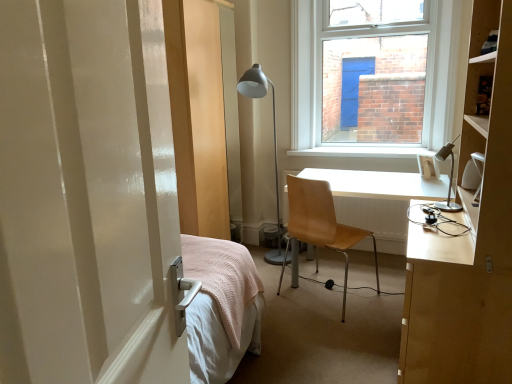
Question: Can you confirm if white plastic picture frame at upper right is positioned to the right of silver metallic desk lamp at right, placed as the second lamp when sorted from back to front?

Choices:
 (A) yes
 (B) no

Answer: (A)

Question: Can you confirm if white plastic picture frame at upper right is wider than silver metallic desk lamp at right, which is counted as the first lamp, starting from the right?

Choices:
 (A) yes
 (B) no

Answer: (B)

Question: Considering the relative positions of white plastic picture frame at upper right and silver metallic desk lamp at right, which is counted as the first lamp, starting from the right, in the image provided, is white plastic picture frame at upper right behind silver metallic desk lamp at right, which is counted as the first lamp, starting from the right,?

Choices:
 (A) yes
 (B) no

Answer: (A)

Question: From the image's perspective, is white plastic picture frame at upper right over silver metallic desk lamp at right, which is counted as the first lamp, starting from the right?

Choices:
 (A) yes
 (B) no

Answer: (A)

Question: Is white plastic picture frame at upper right shorter than silver metallic desk lamp at right, the second lamp in the left-to-right sequence?

Choices:
 (A) yes
 (B) no

Answer: (A)

Question: From a real-world perspective, is light brown wood chair at center above or below white plastic picture frame at upper right?

Choices:
 (A) above
 (B) below

Answer: (B)

Question: Visually, is light brown wood chair at center positioned to the left or to the right of white plastic picture frame at upper right?

Choices:
 (A) right
 (B) left

Answer: (B)

Question: From the image's perspective, is light brown wood chair at center located above or below white plastic picture frame at upper right?

Choices:
 (A) below
 (B) above

Answer: (A)

Question: Does point (376, 273) appear closer or farther from the camera than point (418, 162)?

Choices:
 (A) farther
 (B) closer

Answer: (A)

Question: From their relative heights in the image, would you say light brown wood desk at center right is taller or shorter than white plastic picture frame at upper right?

Choices:
 (A) tall
 (B) short

Answer: (A)

Question: Choose the correct answer: Is light brown wood desk at center right inside white plastic picture frame at upper right or outside it?

Choices:
 (A) inside
 (B) outside

Answer: (B)

Question: From the image's perspective, is light brown wood desk at center right located above or below white plastic picture frame at upper right?

Choices:
 (A) above
 (B) below

Answer: (B)

Question: Is point (369, 203) positioned closer to the camera than point (436, 168)?

Choices:
 (A) farther
 (B) closer

Answer: (A)

Question: Is light brown wood desk at center right taller or shorter than light brown wood chair at center?

Choices:
 (A) tall
 (B) short

Answer: (B)

Question: In the image, is light brown wood desk at center right on the left side or the right side of light brown wood chair at center?

Choices:
 (A) left
 (B) right

Answer: (B)